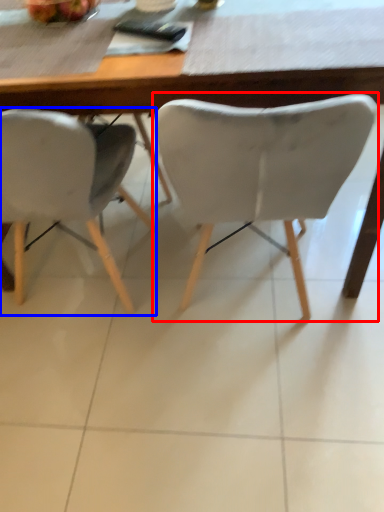
Question: Which of the following is the farthest to the observer, chair (highlighted by a red box) or chair (highlighted by a blue box)?

Choices:
 (A) chair
 (B) chair

Answer: (B)